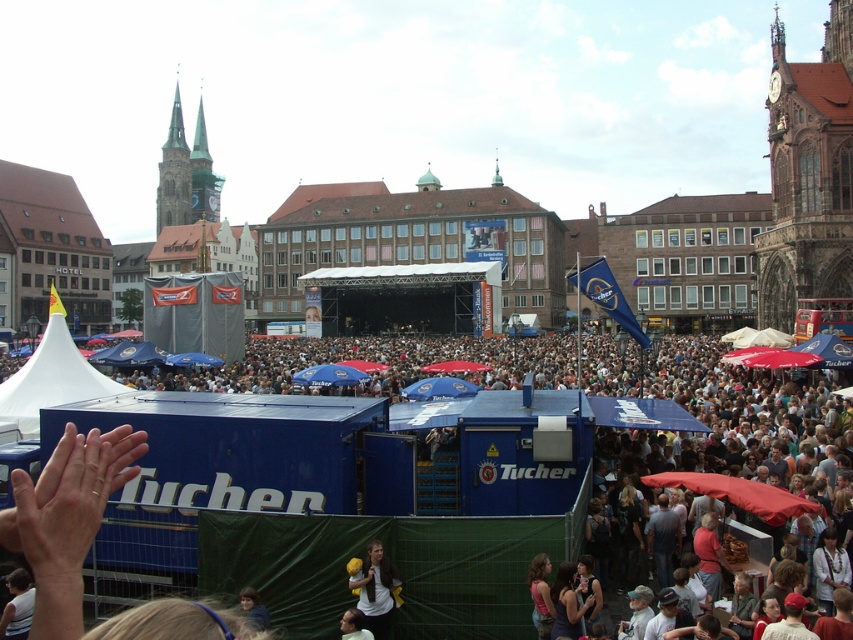
Question: Which of the following is the farthest from the observer?

Choices:
 (A) (347, 620)
 (B) (337, 385)

Answer: (B)

Question: Can you confirm if brown leather jacket at lower center is smaller than blue fabric umbrella at center?

Choices:
 (A) no
 (B) yes

Answer: (B)

Question: Which object is positioned closest to the blue fabric umbrella at center?

Choices:
 (A) smooth skin face at lower center
 (B) brown leather jacket at lower center

Answer: (B)

Question: Does brown leather jacket at lower center appear on the left side of smooth skin face at lower center?

Choices:
 (A) yes
 (B) no

Answer: (B)

Question: Can you confirm if brown leather jacket at lower center is thinner than blue fabric umbrella at center?

Choices:
 (A) no
 (B) yes

Answer: (B)

Question: Estimate the real-world distances between objects in this image. Which object is closer to the smooth skin face at lower center?

Choices:
 (A) blue fabric umbrella at center
 (B) brown leather jacket at lower center

Answer: (B)